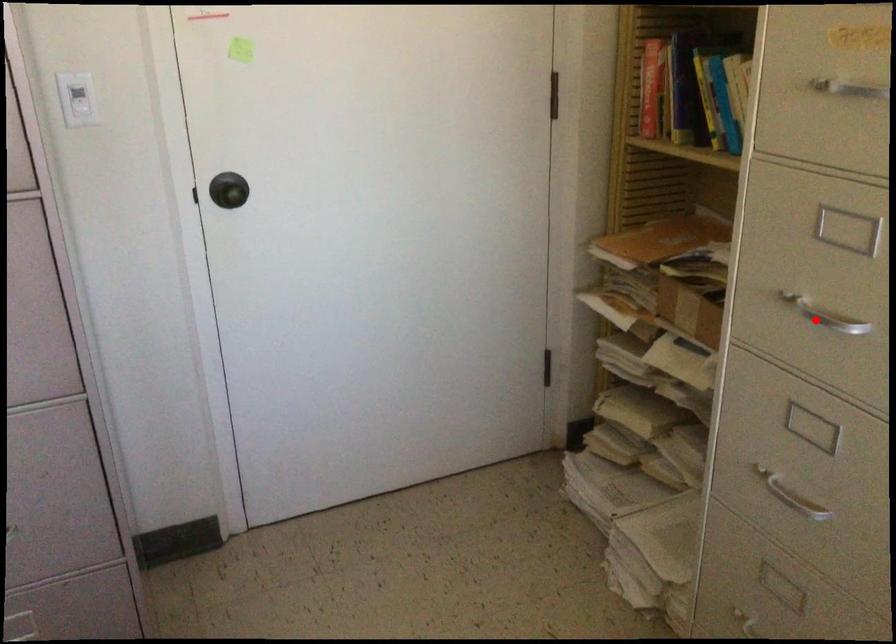
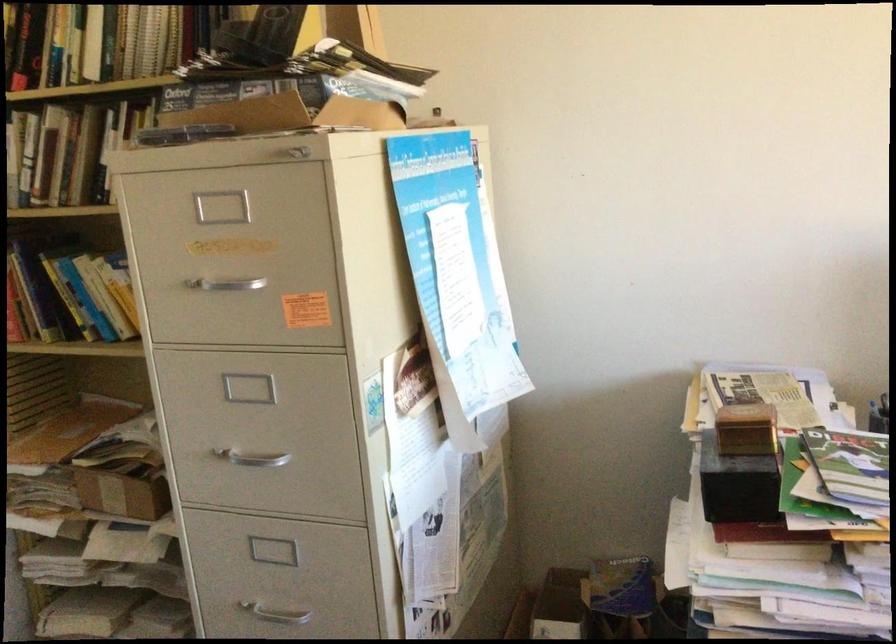
Where in the second image is the point corresponding to the highlighted location from the first image?

(251, 458)